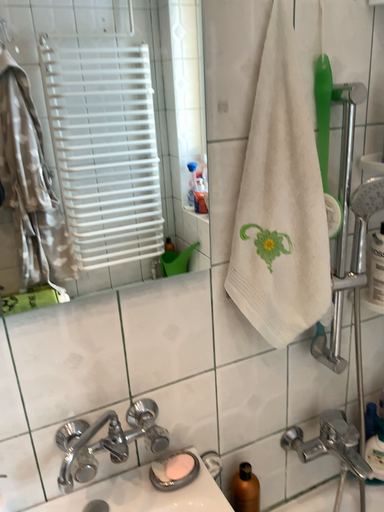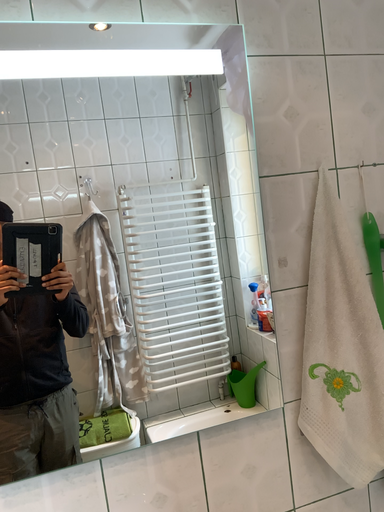
Question: Which way did the camera rotate in the video?

Choices:
 (A) rotated left
 (B) rotated right

Answer: (A)